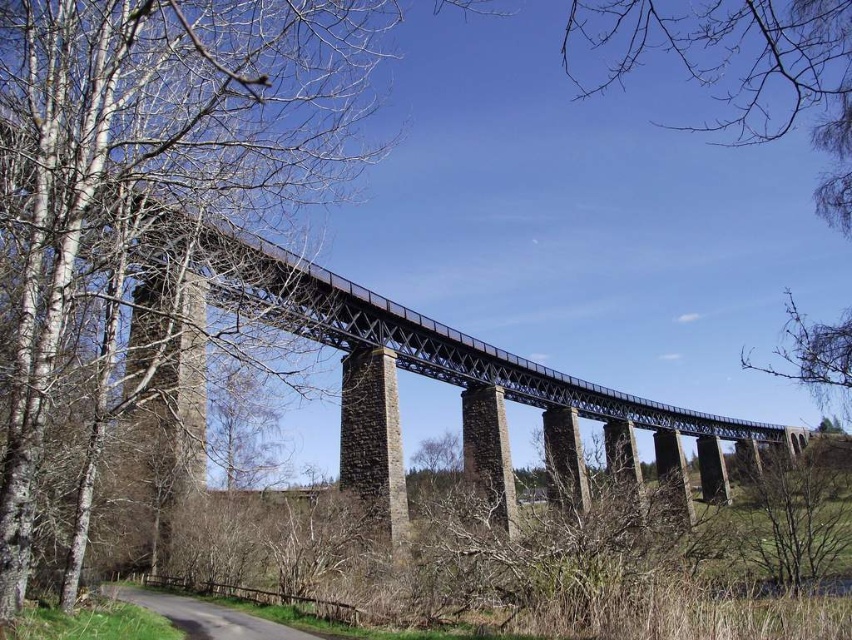
You are a bird flying over the scene. You want to land on the tallest structure between the brown stone bridge at center and the bare branches at upper center. Which one should you choose?

The bare branches at upper center are taller than the brown stone bridge at center, so you should land on the bare branches at upper center.

You are a bird flying over the landscape. You see the bare wood tree at left and the brown stone bridge at center. Which one is shorter?

The bare wood tree at left is shorter than the brown stone bridge at center.